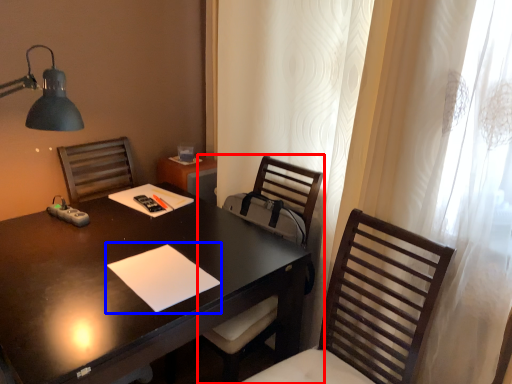
Question: Which object appears farthest to the camera in this image, chair (highlighted by a red box) or notepad (highlighted by a blue box)?

Choices:
 (A) chair
 (B) notepad

Answer: (A)